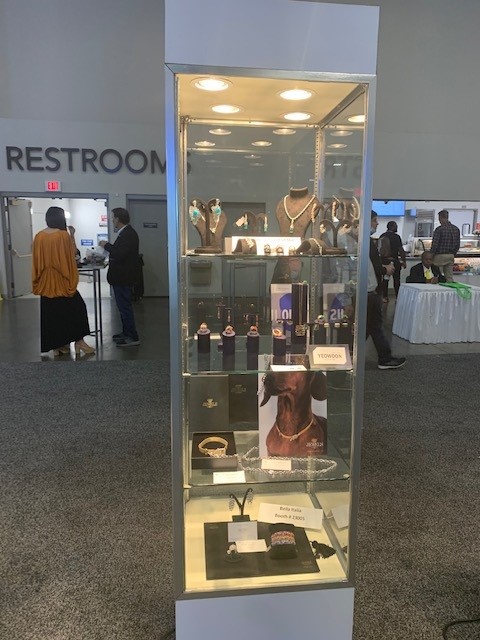
Locate an element on the screen. The image size is (480, 640). exit sign is located at coordinates (52, 189).